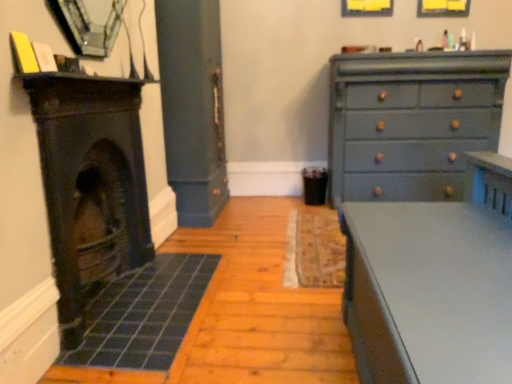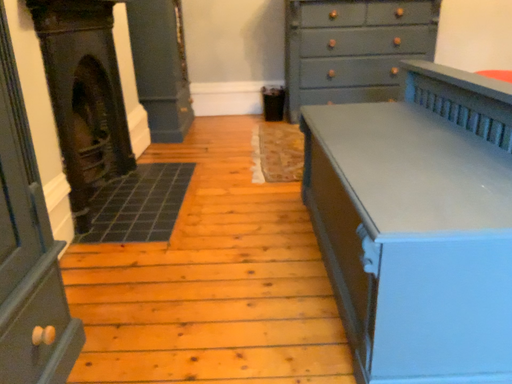
Question: Which way did the camera rotate in the video?

Choices:
 (A) rotated downward
 (B) rotated upward

Answer: (A)